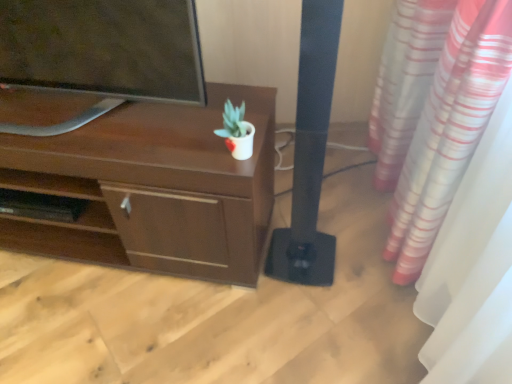
The image size is (512, 384). I want to click on free space behind white glossy pot at center, so click(x=222, y=120).